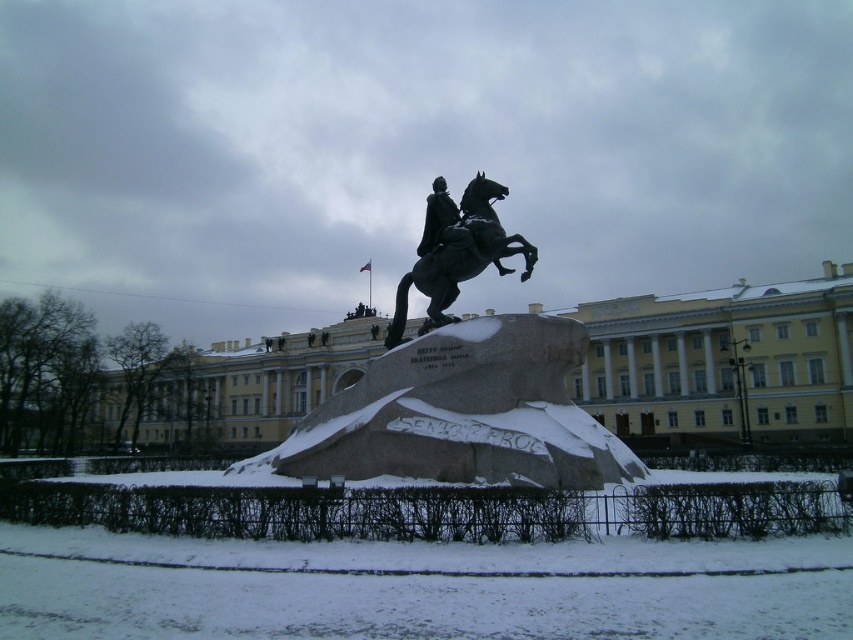
Can you confirm if bronze statue at center is positioned below black polished statue at center?

Yes, bronze statue at center is below black polished statue at center.

Who is more distant from viewer, (x=432, y=282) or (x=466, y=237)?

The point (x=432, y=282) is behind.

This screenshot has width=853, height=640. Find the location of `bronze statue at center`. bronze statue at center is located at coordinates (460, 392).

Is black polished stone horse at center below black polished statue at center?

Indeed, black polished stone horse at center is positioned under black polished statue at center.

Can you confirm if black polished stone horse at center is positioned to the left of black polished statue at center?

Incorrect, black polished stone horse at center is not on the left side of black polished statue at center.

Where is `black polished stone horse at center`? black polished stone horse at center is located at coordinates (456, 252).

This screenshot has height=640, width=853. What do you see at coordinates (460, 392) in the screenshot?
I see `bronze statue at center` at bounding box center [460, 392].

Does bronze statue at center come in front of black polished stone horse at center?

Yes, it is.

Between point (529, 248) and point (494, 186), which one is positioned in front?

Point (529, 248) is more forward.

Locate an element on the screen. bronze statue at center is located at coordinates (460, 392).